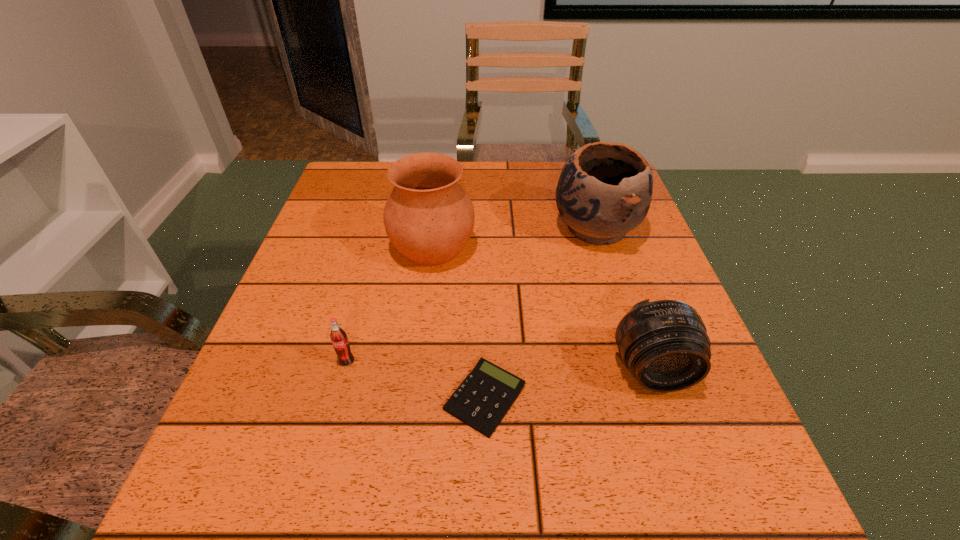
You are a GUI agent. You are given a task and a screenshot of the screen. Output one action in this format:
    pyautogui.click(x=<x>, y=<y>)
    Task: Click on the free space located on the right of the shortest object
    The height and width of the screenshot is (540, 960).
    Given the screenshot: What is the action you would take?
    pyautogui.click(x=726, y=398)

The height and width of the screenshot is (540, 960). I want to click on object at the far edge, so click(604, 191).

Find the location of a particular element. object positioned at the left edge is located at coordinates (338, 336).

The width and height of the screenshot is (960, 540). I want to click on pottery located in the right edge section of the desktop, so click(x=604, y=191).

The height and width of the screenshot is (540, 960). I want to click on telephoto lens present at the right edge, so click(x=664, y=344).

This screenshot has width=960, height=540. Find the location of `object that is at the far right corner`. object that is at the far right corner is located at coordinates (604, 191).

The width and height of the screenshot is (960, 540). In the image, there is a desktop. Find the location of `vacant region at the far edge`. vacant region at the far edge is located at coordinates (553, 181).

Identify the location of vacant space at the left edge. This screenshot has height=540, width=960. (276, 313).

I want to click on vacant space at the right edge of the desktop, so click(734, 419).

Identify the location of vacant space at the far left corner of the desktop. (372, 194).